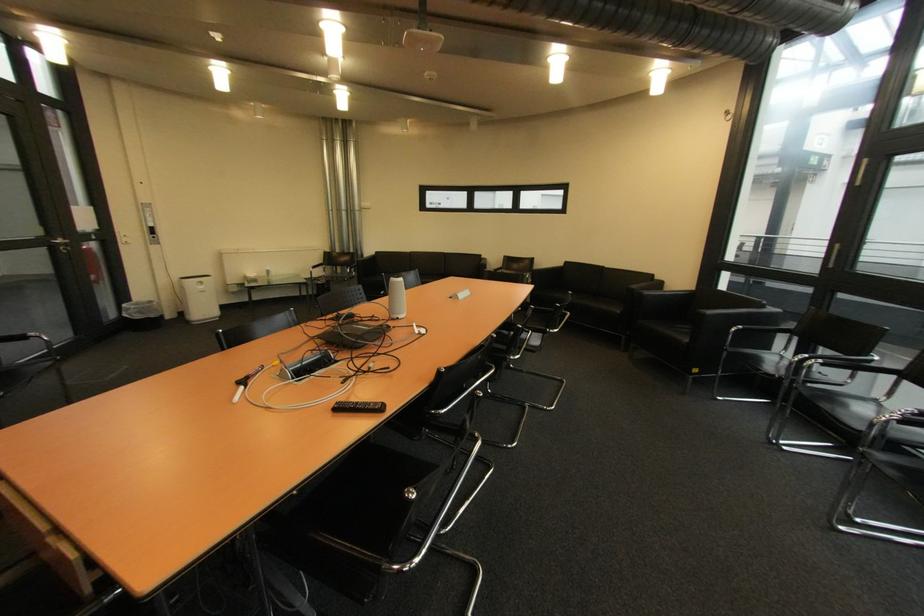
In order to click on white marker pen in this screenshot , I will do `click(245, 382)`.